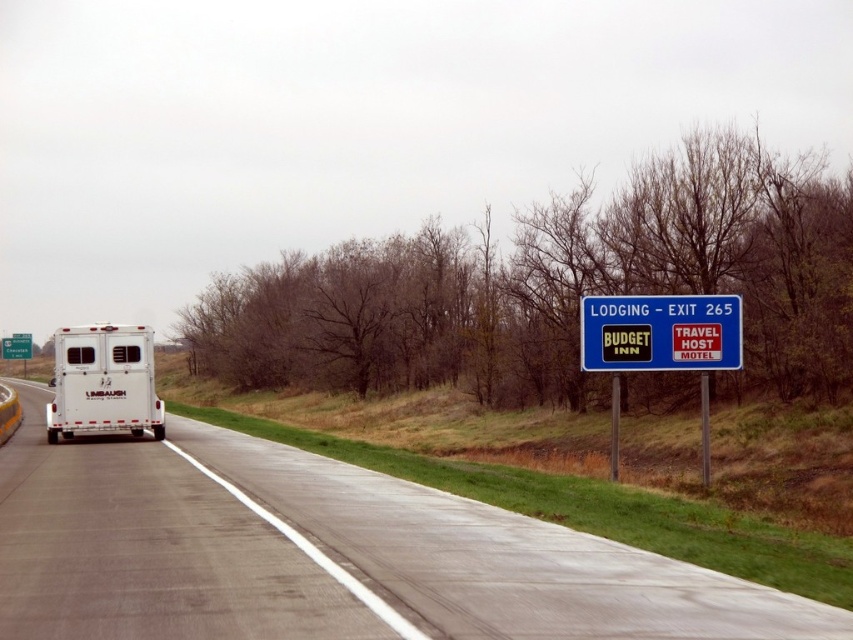
You are a delivery driver needing to pass a white matte horse trailer at left on a gray asphalt highway at center. Since the highway is two lanes, can you safely pass the trailer on the right side?

The gray asphalt highway at center is positioned on the right side of the white matte horse trailer at left, so yes, you can safely pass the white matte horse trailer at left on the right side of the highway.

In the scene shown: You are a GPS device calculating the shortest path from the white horse trailer on the left to the dense area of bare trees on the right. The GPS uses a coordinate system where the origin is at the bottom left corner of the image. The gray asphalt highway at center is represented by point (325, 554). What is the shortest path direction from the white horse trailer on the left to the dense area of bare trees on the right?

The shortest path direction from the white horse trailer on the left to the dense area of bare trees on the right would be towards the gray asphalt highway at center, as it is represented by the coordinate point (325, 554) which lies along the central axis of the road, providing the most direct route between the two points.